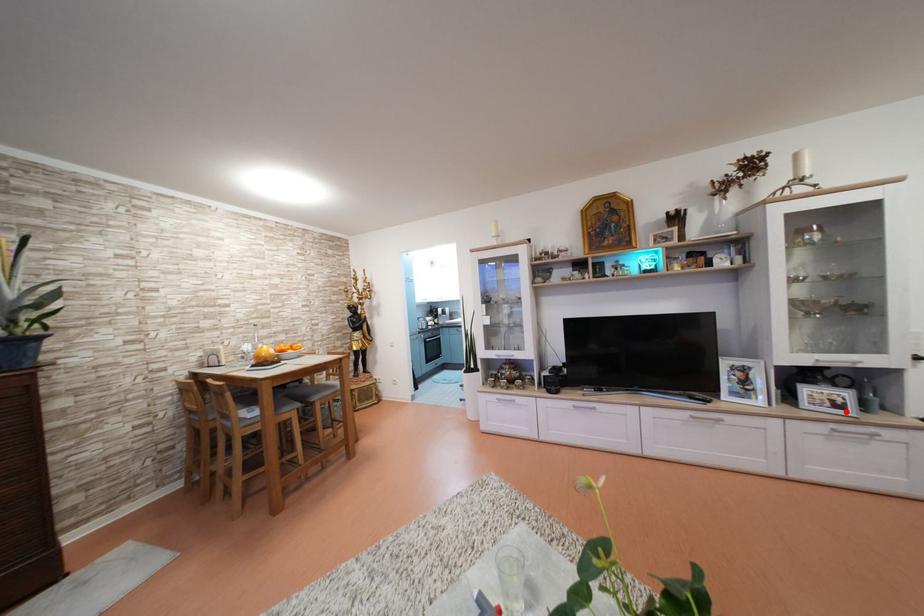
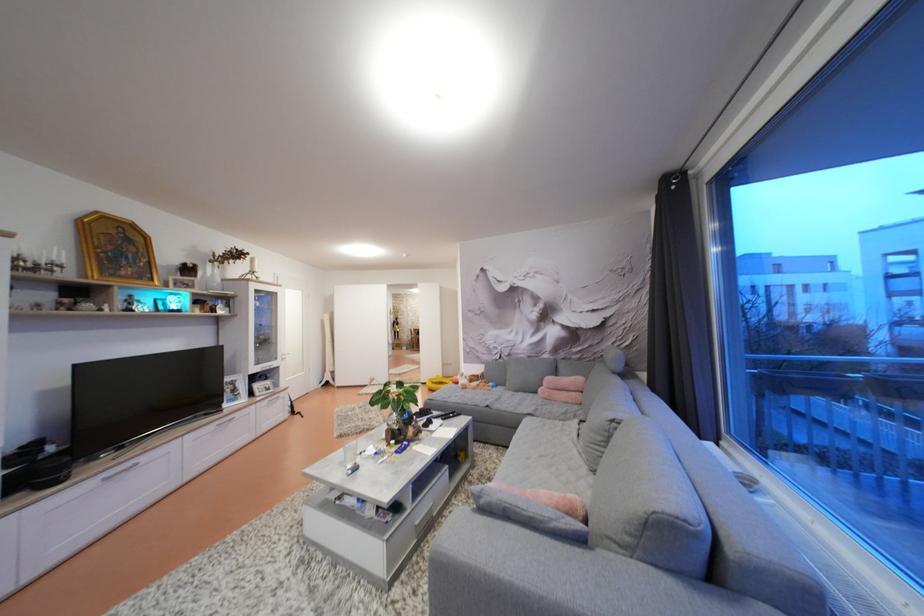
In the second image, find the point that corresponds to the highlighted location in the first image.

(274, 394)